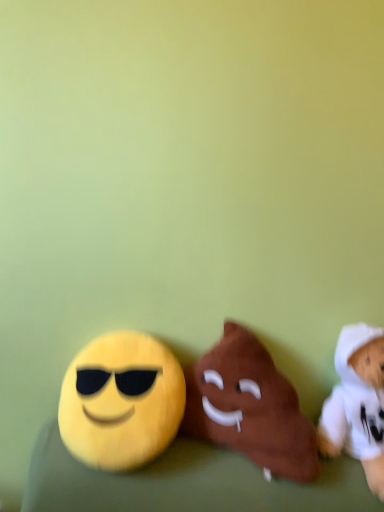
Measure the distance between brown plush poop at center, which is the 2th toy in left-to-right order, and camera.

brown plush poop at center, which is the 2th toy in left-to-right order, is 32.76 inches from camera.

You are a GUI agent. You are given a task and a screenshot of the screen. Output one action in this format:
    pyautogui.click(x=<x>, y=<y>)
    Task: Click on the brown plush poop at center, arranged as the second toy when viewed from the right
    Image resolution: width=384 pixels, height=512 pixels.
    Given the screenshot: What is the action you would take?
    pyautogui.click(x=249, y=407)

Locate an element on the screen. This screenshot has width=384, height=512. white plush toy at right, the first toy viewed from the right is located at coordinates tap(357, 403).

The height and width of the screenshot is (512, 384). What are the coordinates of `yellow plush at left, the third toy positioned from the right` in the screenshot? It's located at (121, 401).

Locate an element on the screen. This screenshot has width=384, height=512. brown plush poop at center, arranged as the second toy when viewed from the right is located at coordinates (249, 407).

In terms of height, does yellow plush at left, the first toy from the left, look taller or shorter compared to white plush toy at right, the first toy viewed from the right?

Considering their sizes, yellow plush at left, the first toy from the left, has less height than white plush toy at right, the first toy viewed from the right.

Which of these two, yellow plush at left, the third toy positioned from the right, or white plush toy at right, the first toy viewed from the right, is bigger?

yellow plush at left, the third toy positioned from the right.

Is yellow plush at left, the first toy from the left, facing towards white plush toy at right, arranged as the 3th toy when viewed from the left?

No, yellow plush at left, the first toy from the left, does not turn towards white plush toy at right, arranged as the 3th toy when viewed from the left.

Which is more to the left, yellow plush at left, the first toy from the left, or white plush toy at right, arranged as the 3th toy when viewed from the left?

yellow plush at left, the first toy from the left.

Is brown plush poop at center, which is the 2th toy in left-to-right order, surrounding yellow plush at left, the first toy from the left?

No, yellow plush at left, the first toy from the left, is located outside of brown plush poop at center, which is the 2th toy in left-to-right order.

From the image's perspective, is brown plush poop at center, arranged as the second toy when viewed from the right, positioned above or below yellow plush at left, the first toy from the left?

brown plush poop at center, arranged as the second toy when viewed from the right, is below yellow plush at left, the first toy from the left.

Identify the location of toy on the left of brown plush poop at center, arranged as the second toy when viewed from the right. (121, 401).

From a real-world perspective, does brown plush poop at center, arranged as the second toy when viewed from the right, stand above yellow plush at left, the first toy from the left?

Indeed, from a real-world perspective, brown plush poop at center, arranged as the second toy when viewed from the right, stands above yellow plush at left, the first toy from the left.

Does point (100, 409) lie behind point (212, 370)?

No, (100, 409) is in front of (212, 370).

Is yellow plush at left, the third toy positioned from the right, bigger or smaller than brown plush poop at center, which is the 2th toy in left-to-right order?

In the image, yellow plush at left, the third toy positioned from the right, appears to be smaller than brown plush poop at center, which is the 2th toy in left-to-right order.

Which object is closer to the camera, yellow plush at left, the third toy positioned from the right, or brown plush poop at center, which is the 2th toy in left-to-right order?

Positioned in front is brown plush poop at center, which is the 2th toy in left-to-right order.

Is white plush toy at right, arranged as the 3th toy when viewed from the left, in front of or behind brown plush poop at center, arranged as the second toy when viewed from the right, in the image?

white plush toy at right, arranged as the 3th toy when viewed from the left, is positioned closer to the viewer than brown plush poop at center, arranged as the second toy when viewed from the right.

From the image's perspective, which toy is the 1st one above the white plush toy at right, arranged as the 3th toy when viewed from the left? Please provide its 2D coordinates.

[(249, 407)]

Which of these two, white plush toy at right, arranged as the 3th toy when viewed from the left, or brown plush poop at center, which is the 2th toy in left-to-right order, stands shorter?

brown plush poop at center, which is the 2th toy in left-to-right order, is shorter.

Based on the photo, considering the sizes of objects white plush toy at right, the first toy viewed from the right, and brown plush poop at center, which is the 2th toy in left-to-right order, in the image provided, who is thinner, white plush toy at right, the first toy viewed from the right, or brown plush poop at center, which is the 2th toy in left-to-right order,?

Thinner between the two is white plush toy at right, the first toy viewed from the right.

From the picture: Visually, is white plush toy at right, arranged as the 3th toy when viewed from the left, positioned to the left or to the right of yellow plush at left, the third toy positioned from the right?

From the image, it's evident that white plush toy at right, arranged as the 3th toy when viewed from the left, is to the right of yellow plush at left, the third toy positioned from the right.

Considering the sizes of white plush toy at right, the first toy viewed from the right, and yellow plush at left, the third toy positioned from the right, in the image, is white plush toy at right, the first toy viewed from the right, bigger or smaller than yellow plush at left, the third toy positioned from the right,?

white plush toy at right, the first toy viewed from the right, is smaller than yellow plush at left, the third toy positioned from the right.

Considering the sizes of objects white plush toy at right, arranged as the 3th toy when viewed from the left, and yellow plush at left, the third toy positioned from the right, in the image provided, who is wider, white plush toy at right, arranged as the 3th toy when viewed from the left, or yellow plush at left, the third toy positioned from the right,?

Wider between the two is white plush toy at right, arranged as the 3th toy when viewed from the left.

Is point (324, 424) behind point (123, 456)?

That is True.

Does point (287, 412) come farther from viewer compared to point (359, 446)?

No, it is not.

Find the location of a particular element. This screenshot has height=512, width=384. toy in front of the brown plush poop at center, arranged as the second toy when viewed from the right is located at coordinates (357, 403).

Is brown plush poop at center, which is the 2th toy in left-to-right order, smaller than white plush toy at right, arranged as the 3th toy when viewed from the left?

Incorrect, brown plush poop at center, which is the 2th toy in left-to-right order, is not smaller in size than white plush toy at right, arranged as the 3th toy when viewed from the left.

From the image's perspective, would you say brown plush poop at center, arranged as the second toy when viewed from the right, is positioned over white plush toy at right, arranged as the 3th toy when viewed from the left?

Indeed, from the image's perspective, brown plush poop at center, arranged as the second toy when viewed from the right, is shown above white plush toy at right, arranged as the 3th toy when viewed from the left.

From a real-world perspective, starting from the white plush toy at right, arranged as the 3th toy when viewed from the left, which toy is the 2nd one below it? Please provide its 2D coordinates.

[(121, 401)]

From the image's perspective, starting from the yellow plush at left, the third toy positioned from the right, which toy is the 1st one below? Please provide its 2D coordinates.

[(249, 407)]

Estimate the real-world distances between objects in this image. Which object is closer to yellow plush at left, the first toy from the left, brown plush poop at center, which is the 2th toy in left-to-right order, or white plush toy at right, arranged as the 3th toy when viewed from the left?

The object closer to yellow plush at left, the first toy from the left, is brown plush poop at center, which is the 2th toy in left-to-right order.

From the image, which object appears to be farther from brown plush poop at center, which is the 2th toy in left-to-right order, yellow plush at left, the first toy from the left, or white plush toy at right, the first toy viewed from the right?

Among the two, white plush toy at right, the first toy viewed from the right, is located further to brown plush poop at center, which is the 2th toy in left-to-right order.

From the image, which object appears to be farther from white plush toy at right, the first toy viewed from the right, brown plush poop at center, which is the 2th toy in left-to-right order, or yellow plush at left, the first toy from the left?

Among the two, yellow plush at left, the first toy from the left, is located further to white plush toy at right, the first toy viewed from the right.

Looking at the image, which one is located closer to yellow plush at left, the third toy positioned from the right, white plush toy at right, arranged as the 3th toy when viewed from the left, or brown plush poop at center, arranged as the second toy when viewed from the right?

brown plush poop at center, arranged as the second toy when viewed from the right, is positioned closer to the anchor yellow plush at left, the third toy positioned from the right.

Which object lies further to the anchor point brown plush poop at center, arranged as the second toy when viewed from the right, white plush toy at right, arranged as the 3th toy when viewed from the left, or yellow plush at left, the first toy from the left?

The object further to brown plush poop at center, arranged as the second toy when viewed from the right, is white plush toy at right, arranged as the 3th toy when viewed from the left.

Which object lies nearer to the anchor point white plush toy at right, the first toy viewed from the right, yellow plush at left, the third toy positioned from the right, or brown plush poop at center, which is the 2th toy in left-to-right order?

brown plush poop at center, which is the 2th toy in left-to-right order.

What are the coordinates of `toy between yellow plush at left, the first toy from the left, and white plush toy at right, arranged as the 3th toy when viewed from the left, from left to right` in the screenshot? It's located at (249, 407).